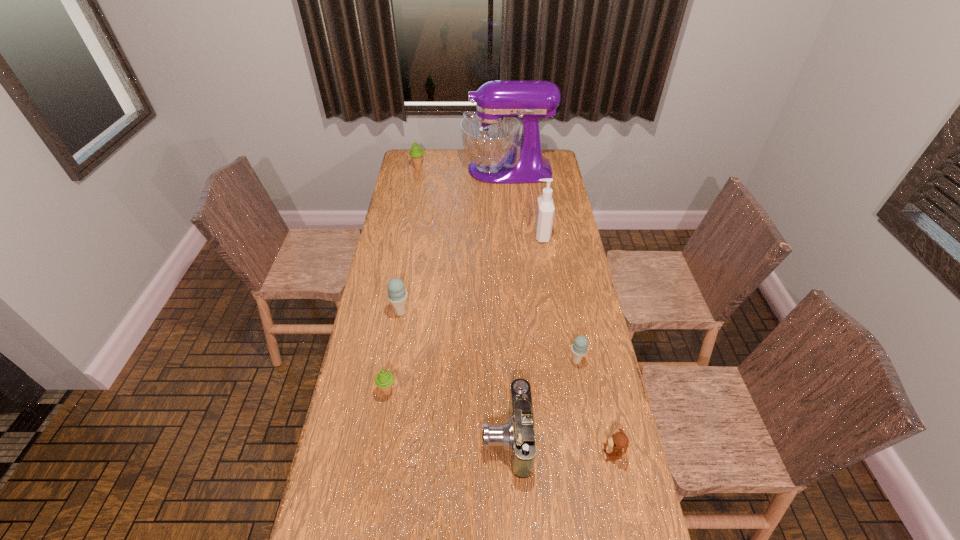
In order to click on the smaller green icecream in this screenshot , I will do `click(384, 379)`.

You are a GUI agent. You are given a task and a screenshot of the screen. Output one action in this format:
    pyautogui.click(x=<x>, y=<y>)
    Task: Click on the smaller blue ice cream
    The image size is (960, 540).
    Given the screenshot: What is the action you would take?
    pyautogui.click(x=579, y=348)

Where is `the rightmost ice cream`? the rightmost ice cream is located at coordinates pyautogui.click(x=579, y=348).

This screenshot has height=540, width=960. In order to click on brown teddy bear in this screenshot , I will do `click(618, 443)`.

Identify the location of the shortest object. (618, 443).

The height and width of the screenshot is (540, 960). I want to click on blank space located at the bowl opening of the purple mixer, so click(x=424, y=170).

I want to click on vacant space located 0.180m at the bowl opening of the purple mixer, so click(428, 170).

Locate an element on the screen. vacant space located at the bowl opening of the purple mixer is located at coordinates coord(443,170).

Locate an element on the screen. The image size is (960, 540). vacant region located on the front label of the seventh shortest object is located at coordinates (460, 235).

At what (x,y) coordinates should I click in order to perform the action: click on vacant space located 0.170m on the front label of the seventh shortest object. Please return your answer as a coordinate pair (x, y). Looking at the image, I should click on (495, 235).